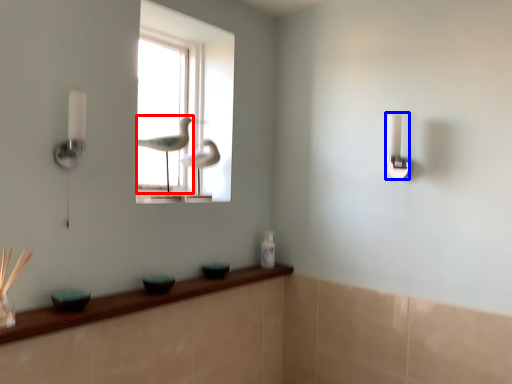
Question: Which of the following is the closest to the observer, bird (highlighted by a red box) or light switch (highlighted by a blue box)?

Choices:
 (A) bird
 (B) light switch

Answer: (B)